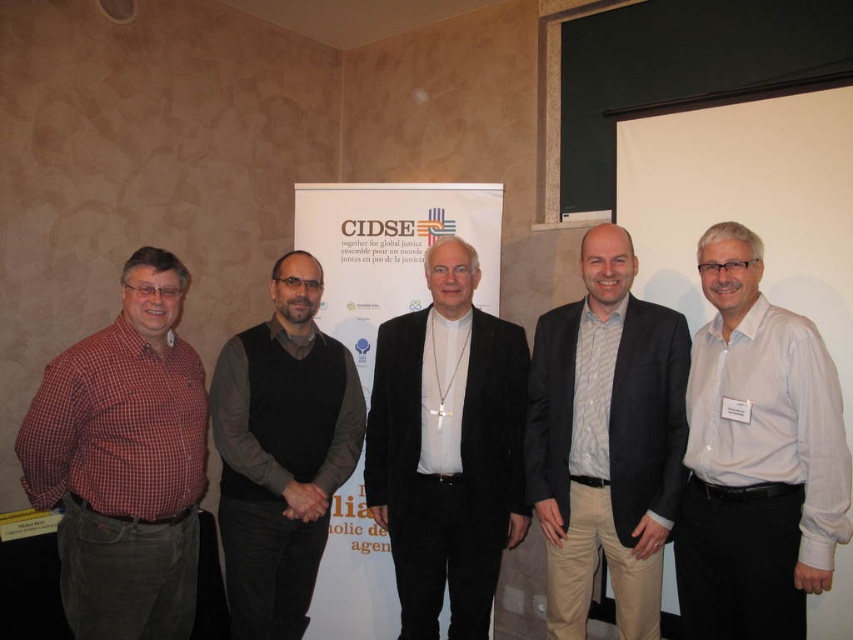
Between light beige cotton pants at center and velvet black suit at center, which one has more height?

velvet black suit at center is taller.

Does light beige cotton pants at center appear on the left side of velvet black suit at center?

No, light beige cotton pants at center is not to the left of velvet black suit at center.

Which is behind, point (563, 476) or point (467, 285)?

Positioned behind is point (467, 285).

Identify the location of light beige cotton pants at center. The image size is (853, 640). (606, 440).

This screenshot has height=640, width=853. I want to click on red checkered shirt at left, so click(125, 461).

Who is more forward, [170,586] or [648,461]?

Point [170,586] is in front.

Which is in front, point (173, 445) or point (602, 289)?

Positioned in front is point (173, 445).

Where is `red checkered shirt at left`? The width and height of the screenshot is (853, 640). red checkered shirt at left is located at coordinates (125, 461).

Is point (422, 636) farther from viewer compared to point (590, 168)?

That is False.

Is velvet black suit at center wider than white matte projector screen at upper right?

No.

Measure the distance between velvet black suit at center and camera.

velvet black suit at center and camera are 2.48 meters apart.

Find the location of a particular element. velvet black suit at center is located at coordinates (447, 448).